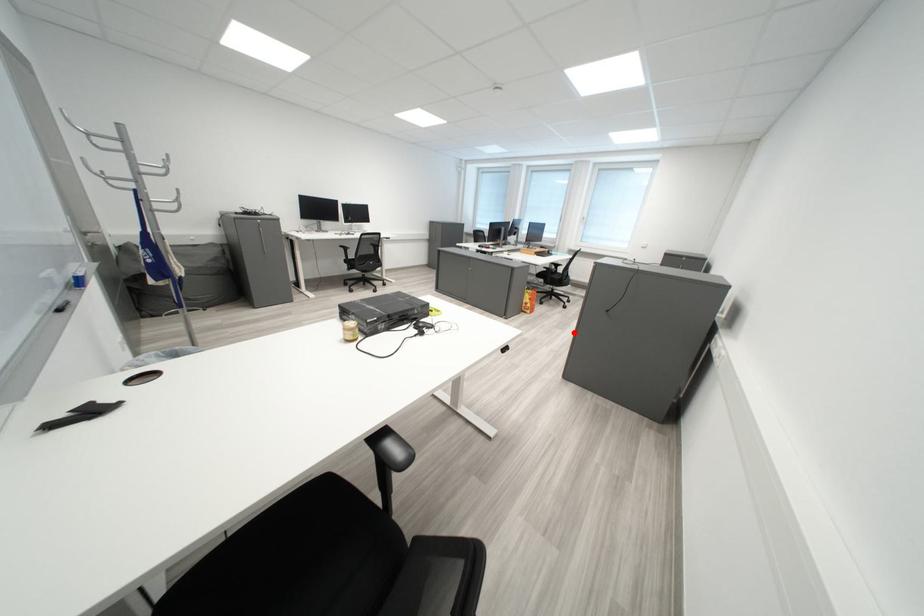
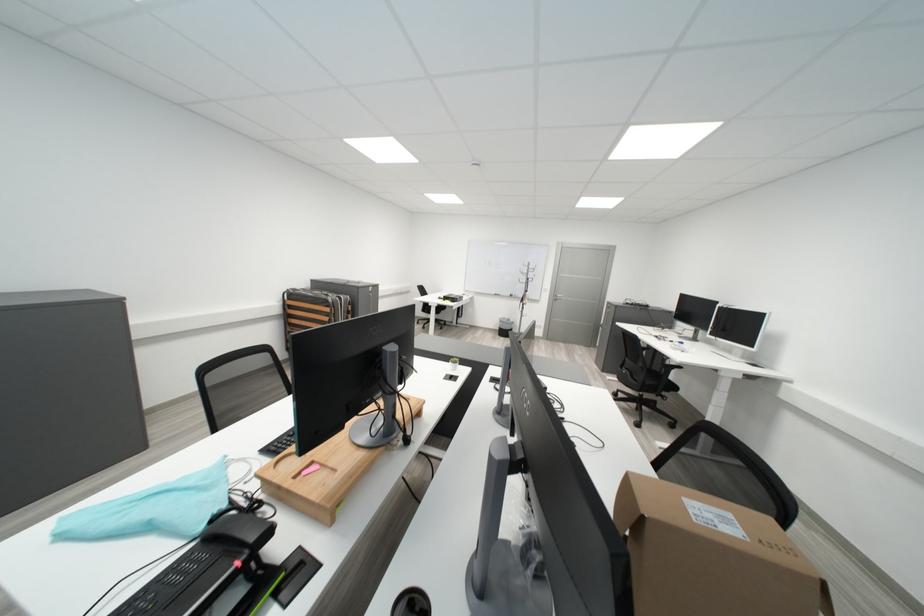
Question: I am providing you with two images of the same scene from different viewpoints. A red point is marked on the first image. Can you still see the location of the red point in image 2?

Choices:
 (A) Yes
 (B) No

Answer: (B)